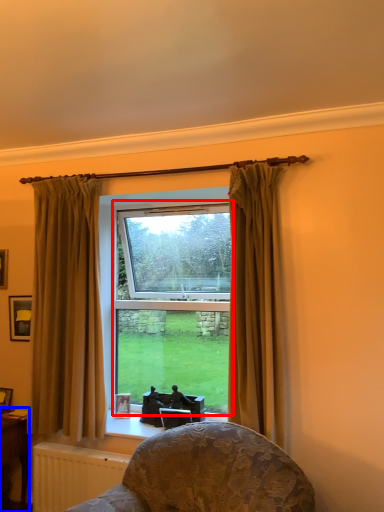
Question: Among these objects, which one is nearest to the camera, bay window (highlighted by a red box) or table (highlighted by a blue box)?

Choices:
 (A) bay window
 (B) table

Answer: (B)